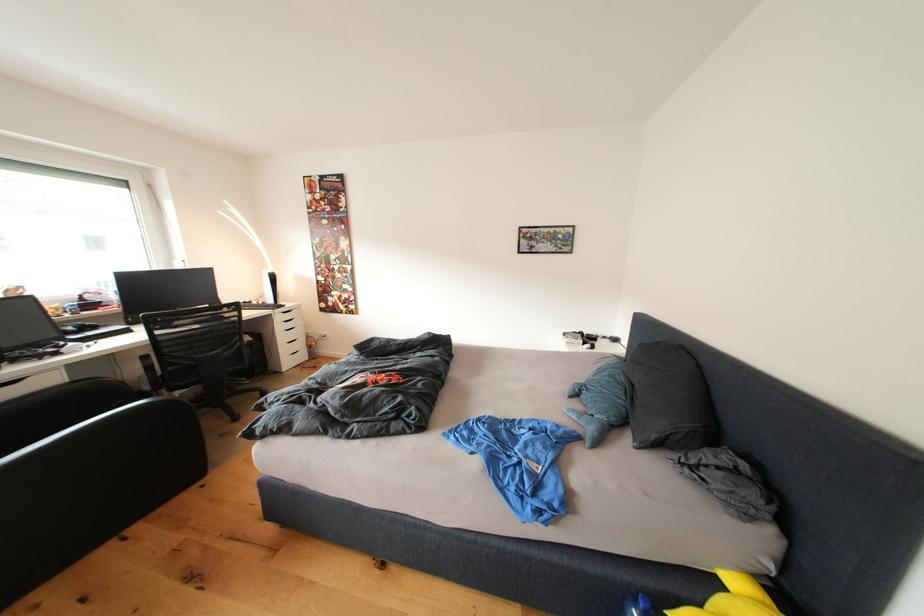
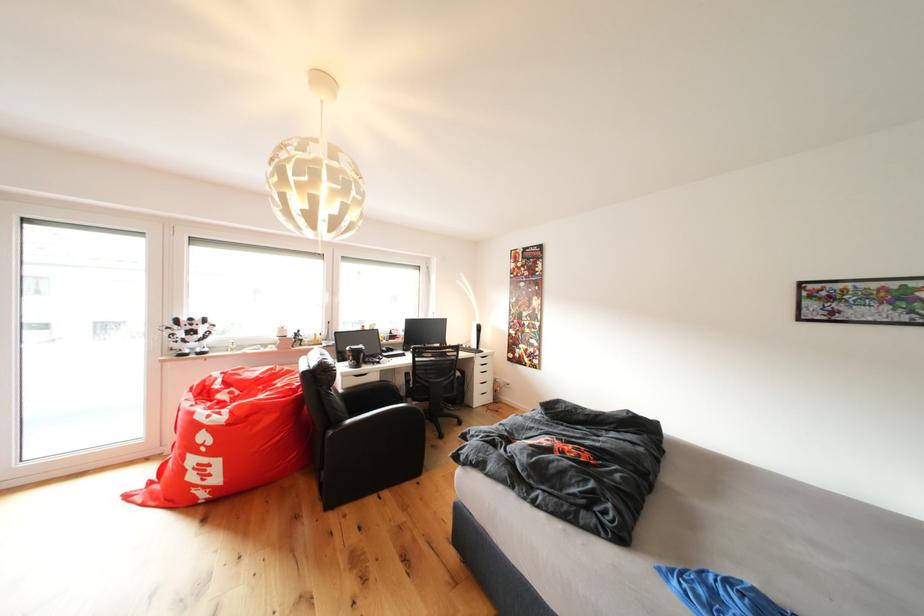
Locate, in the second image, the point that corresponds to pixel 81 387 in the first image.

(390, 387)